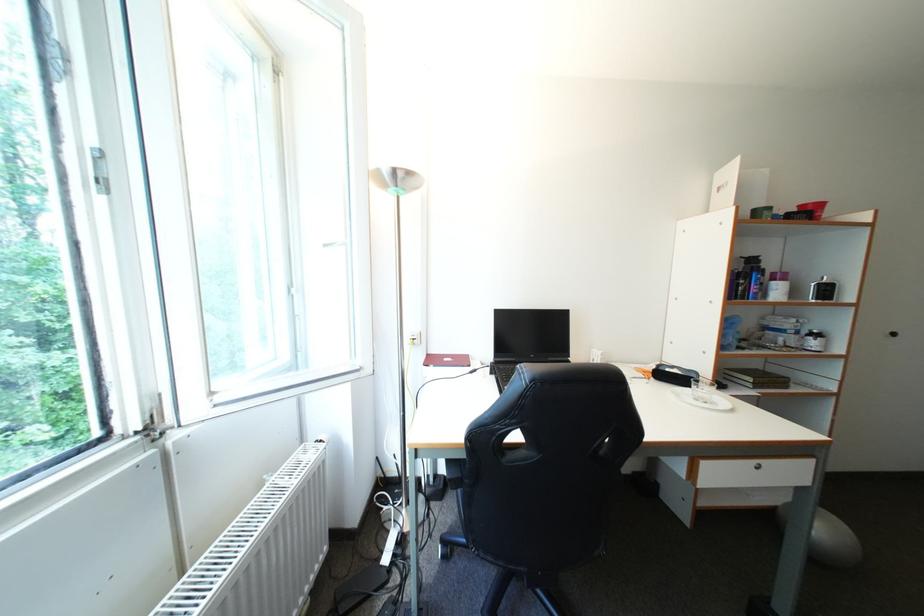
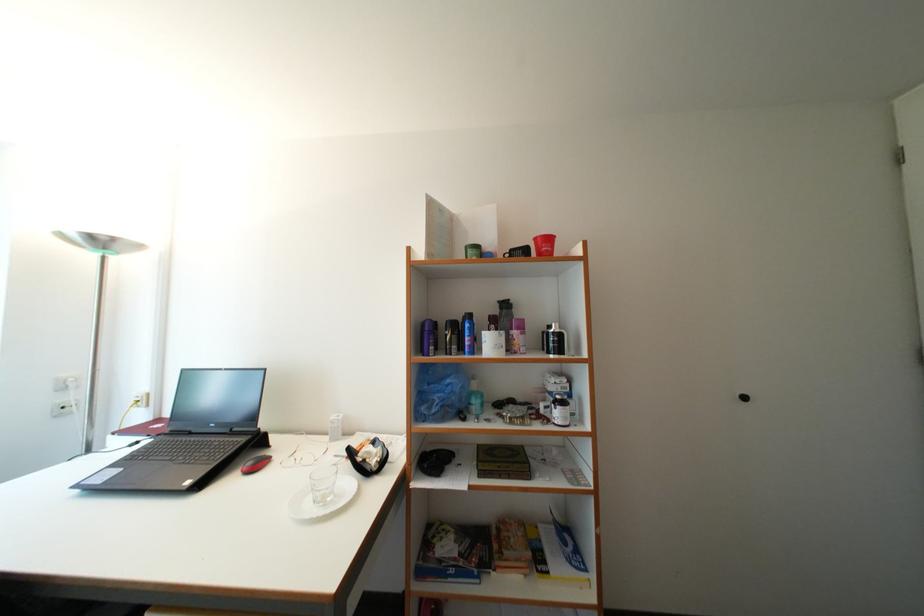
Question: Which direction would the cameraman need to move to produce the second image? Reply with the corresponding letter.

Choices:
 (A) Left
 (B) Right
 (C) Forward
 (D) Backward

Answer: (B)